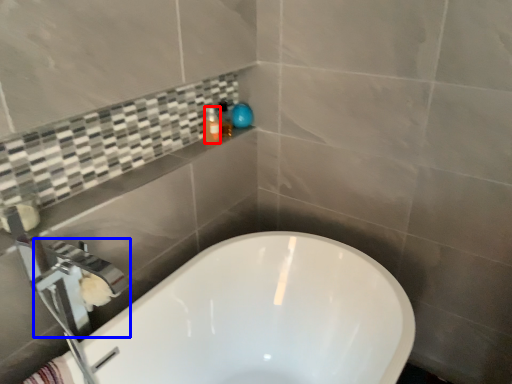
Question: Which object appears closest to the camera in this image, toiletry (highlighted by a red box) or faucet (highlighted by a blue box)?

Choices:
 (A) toiletry
 (B) faucet

Answer: (B)